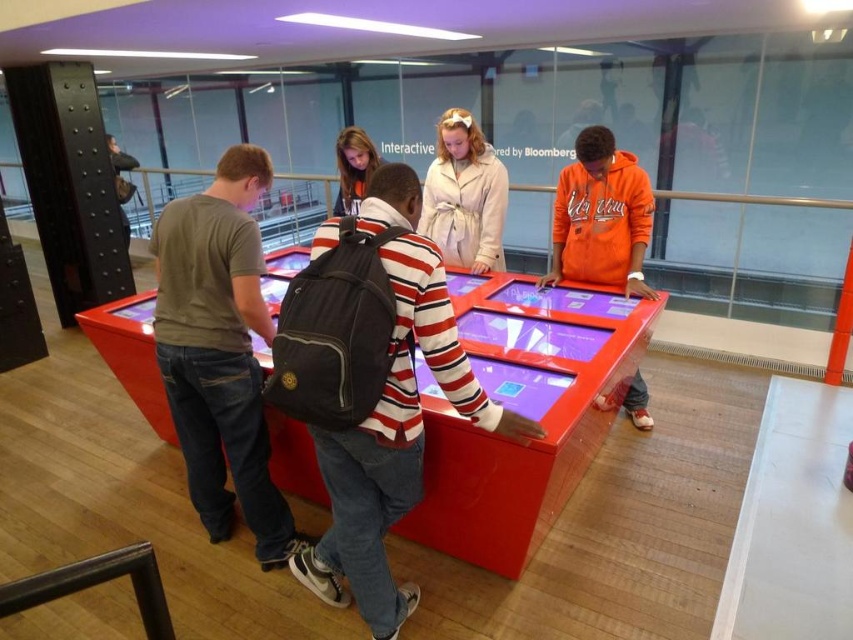
You are a visitor at the exhibit and want to place your small rectangular box on the table without blocking the screens. The orange fleece jacket at right and dark gray backpack at upper left are on the table. Which object can you move to make space?

The orange fleece jacket at right is not as tall as the dark gray backpack at upper left, so you can move the orange fleece jacket at right to make space since it is smaller in height and may be easier to relocate.

You are standing in front of the multi touch display table and want to hand a document to the person wearing the striped cotton shirt at center and the light beige trench coat at center. Which one can you reach first without moving your position?

The striped cotton shirt at center is closer to the viewer than the light beige trench coat at center, so you can reach the person wearing the striped cotton shirt at center first without moving your position.

You are a security guard in the exhibit space. You need to ensure that the striped cotton shirt at center and the matte black backpack at center are visible in the security camera feed. Which object is more likely to be visible in the camera feed?

The striped cotton shirt at center is much taller than the matte black backpack at center, so it is more likely to be visible in the security camera feed.